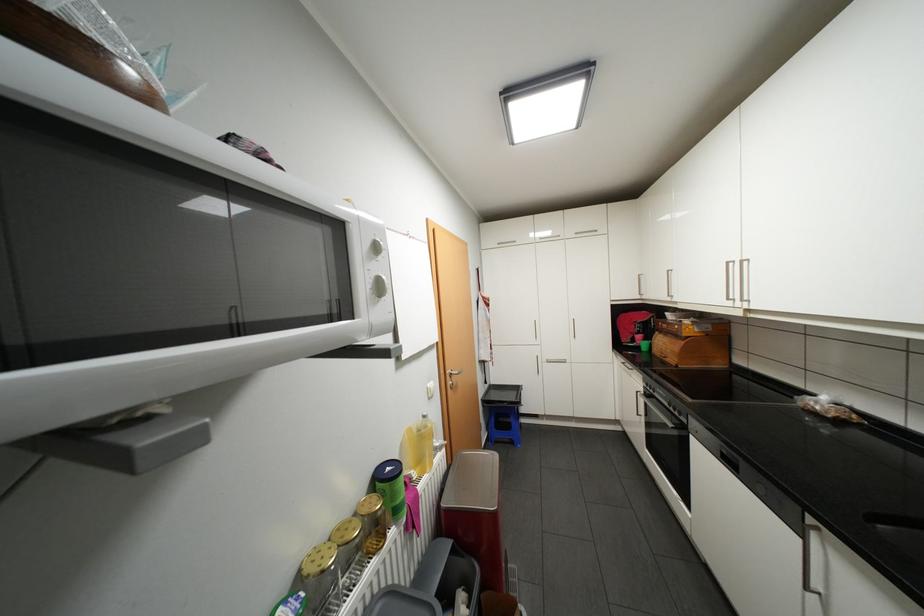
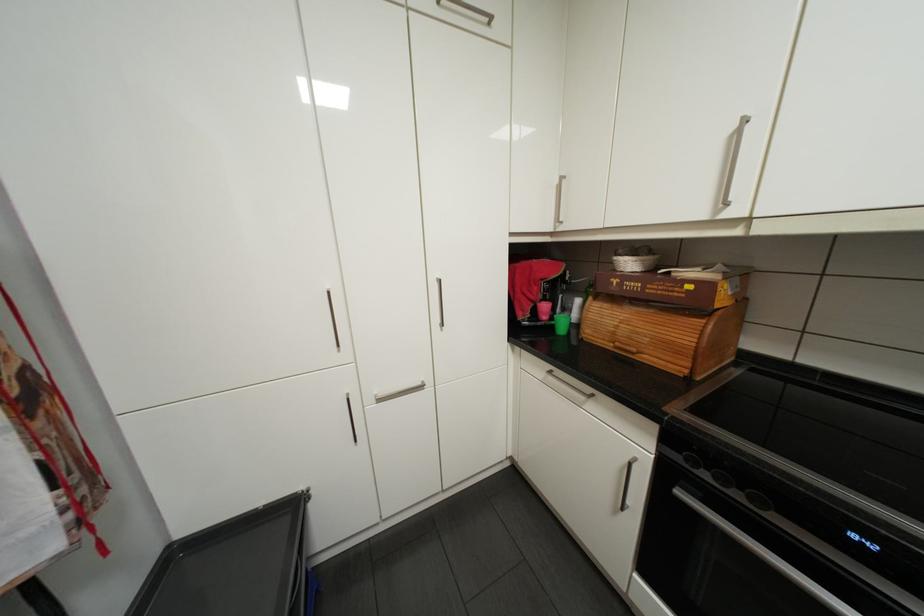
Find the pixel in the second image that matches point 647,346 in the first image.

(557, 328)